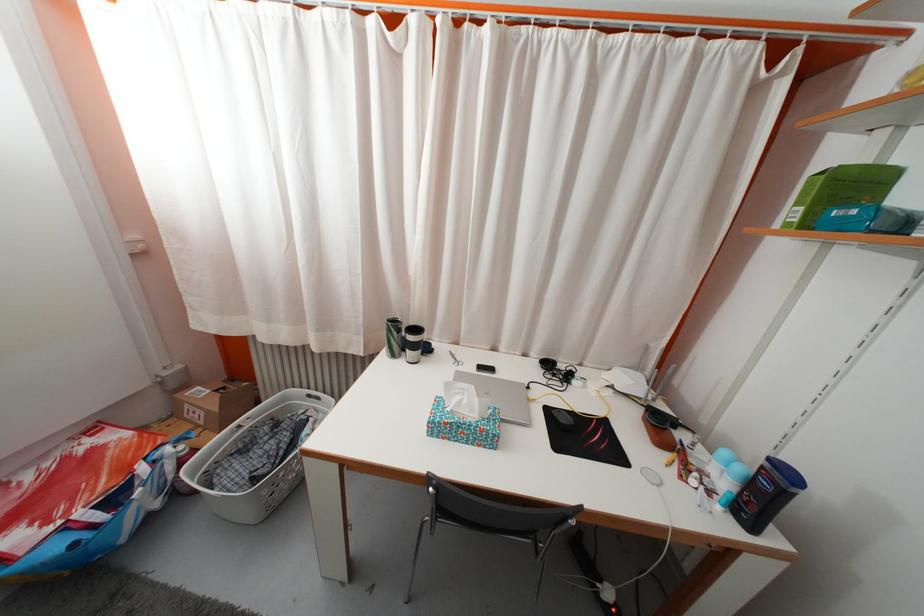
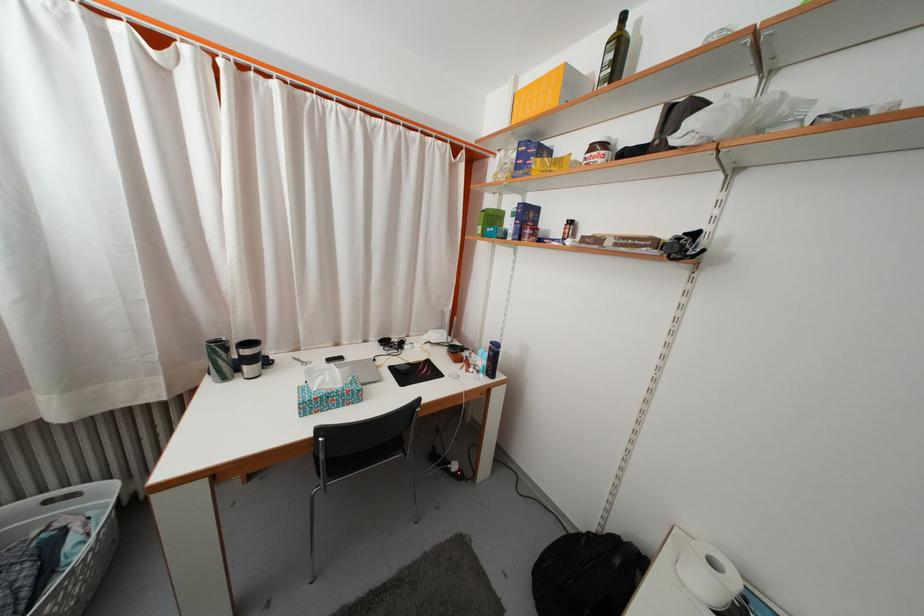
Find the pixel in the second image that matches the point at 859,195 in the first image.

(500, 225)